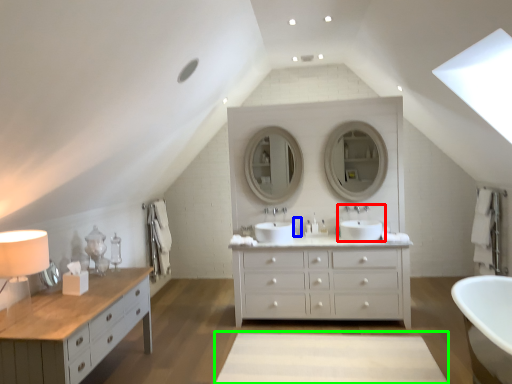
Question: Based on their relative distances, which object is farther from sink (highlighted by a red box)? Choose from toiletry (highlighted by a blue box) and plain (highlighted by a green box).

Choices:
 (A) toiletry
 (B) plain

Answer: (B)